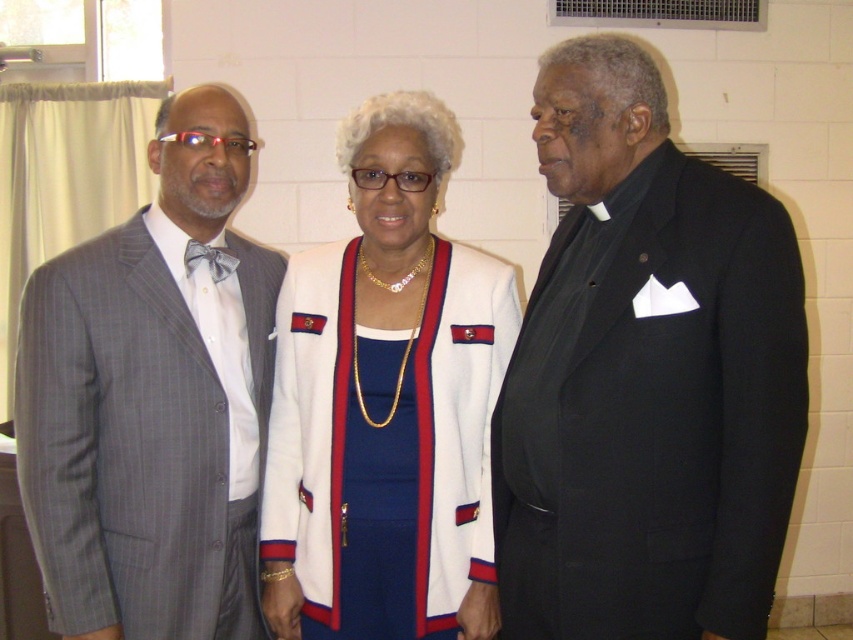
Question: Among these points, which one is farthest from the camera?

Choices:
 (A) (419, 451)
 (B) (633, 552)

Answer: (A)

Question: In this image, where is black satin suit at right located relative to gray pinstripe suit at left?

Choices:
 (A) right
 (B) left

Answer: (A)

Question: Which object is positioned closest to the black satin suit at right?

Choices:
 (A) white fabric jacket at center
 (B) gray pinstripe suit at left

Answer: (A)

Question: Is gray pinstripe suit at left to the left of white fabric jacket at center from the viewer's perspective?

Choices:
 (A) yes
 (B) no

Answer: (A)

Question: Can you confirm if black satin suit at right is thinner than white fabric jacket at center?

Choices:
 (A) yes
 (B) no

Answer: (A)

Question: Which point appears closest to the camera in this image?

Choices:
 (A) (627, 506)
 (B) (61, 532)
 (C) (296, 611)

Answer: (A)